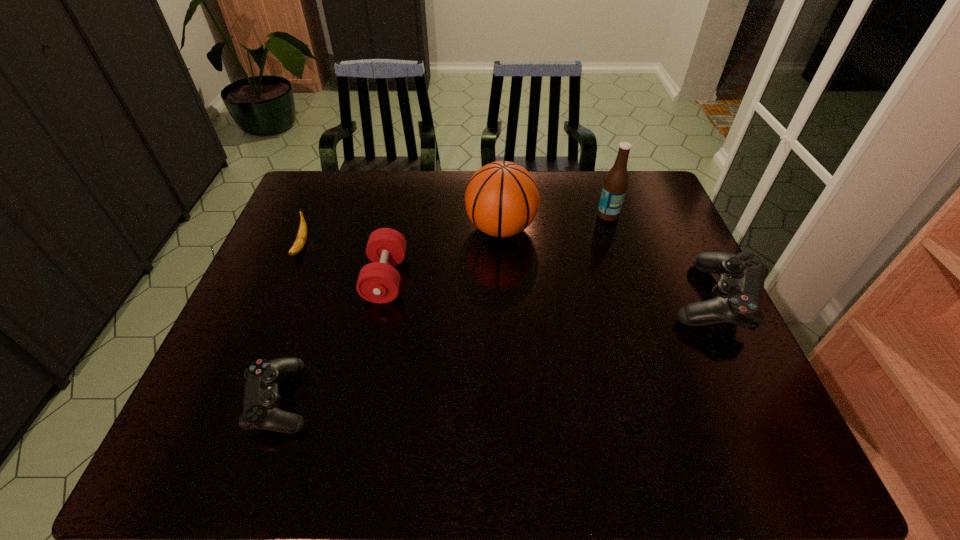
Find the location of a particular element. empty location between the fourth object from right to left and the taller control is located at coordinates (550, 289).

Where is `unoccupied area between the right control and the fifth object from left to right`? The width and height of the screenshot is (960, 540). unoccupied area between the right control and the fifth object from left to right is located at coordinates (660, 257).

At what (x,y) coordinates should I click in order to perform the action: click on empty location between the left control and the taller control. Please return your answer as a coordinate pair (x, y). The height and width of the screenshot is (540, 960). Looking at the image, I should click on (497, 349).

Identify the location of empty location between the fourth object from right to left and the third object from right to left. (444, 253).

Find the location of a particular element. vacant point located between the nearer control and the banana is located at coordinates (291, 323).

Locate an element on the screen. The image size is (960, 540). vacant area that lies between the second object from right to left and the dumbbell is located at coordinates (497, 247).

The image size is (960, 540). I want to click on vacant space that is in between the leftmost object and the shorter control, so click(x=291, y=323).

The width and height of the screenshot is (960, 540). Identify the location of free space that is in between the third object from left to right and the right control. (550, 289).

The width and height of the screenshot is (960, 540). I want to click on object that is the closest to the nearest object, so click(378, 282).

This screenshot has height=540, width=960. What are the coordinates of `the second closest object to the nearer control` in the screenshot? It's located at (299, 243).